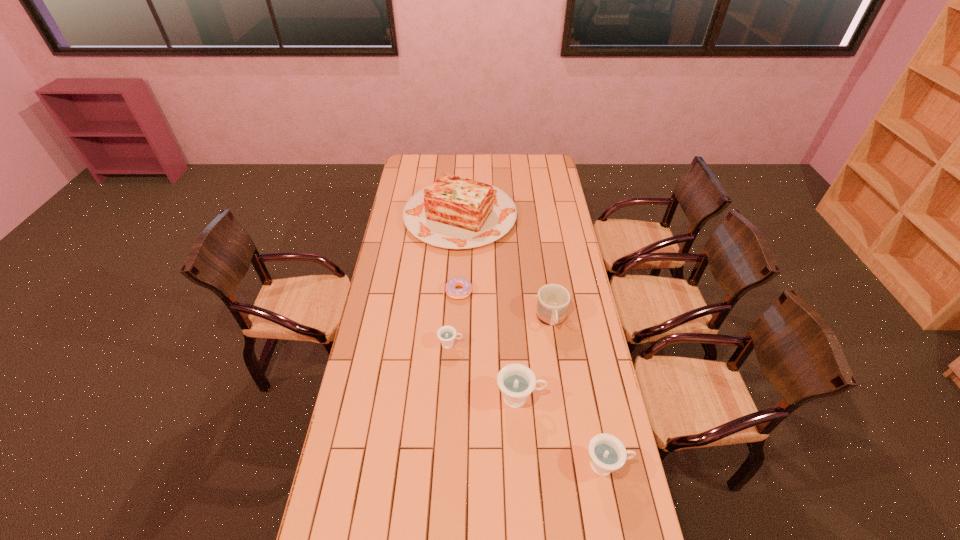
In order to click on mug in this screenshot , I will do `click(553, 300)`.

At what (x,y) coordinates should I click in order to perform the action: click on free location located on the side of the farthest teacup with the handle. Please return your answer as a coordinate pair (x, y). The width and height of the screenshot is (960, 540). Looking at the image, I should click on pyautogui.click(x=511, y=344).

Locate an element on the screen. The image size is (960, 540). vacant space situated 0.180m on the side of the second nearest teacup with the handle is located at coordinates (595, 398).

The image size is (960, 540). Identify the location of free spot located on the front of the tallest object. point(455,317).

Where is `vacant space located 0.290m on the left of the doughnut`? This screenshot has height=540, width=960. vacant space located 0.290m on the left of the doughnut is located at coordinates (380, 292).

Locate an element on the screen. This screenshot has height=540, width=960. vacant space located on the side with the handle of the mug is located at coordinates (560, 377).

Locate an element on the screen. The height and width of the screenshot is (540, 960). object that is at the left edge is located at coordinates (455, 213).

Identify the location of teacup at the right edge. (607, 453).

Where is `mug positioned at the right edge`? This screenshot has height=540, width=960. mug positioned at the right edge is located at coordinates (553, 300).

The width and height of the screenshot is (960, 540). I want to click on free spot at the far edge of the desktop, so click(x=482, y=163).